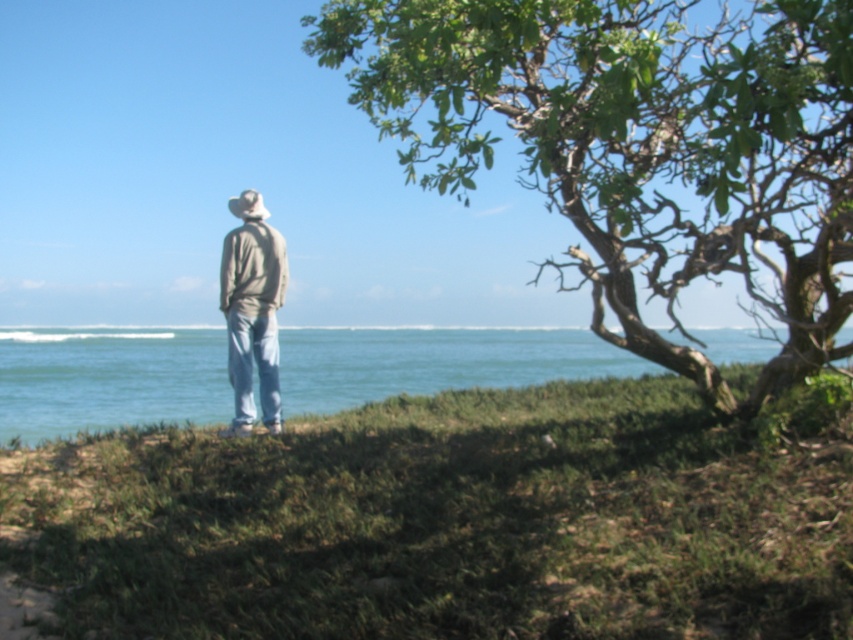
Question: Does green grass at lower center have a larger size compared to light gray cotton jacket at center?

Choices:
 (A) yes
 (B) no

Answer: (A)

Question: Which of the following is the farthest from the observer?

Choices:
 (A) blue water at center
 (B) green leafy tree at upper right

Answer: (B)

Question: Considering the relative positions of blue water at center and light gray cotton jacket at center in the image provided, where is blue water at center located with respect to light gray cotton jacket at center?

Choices:
 (A) below
 (B) above

Answer: (A)

Question: Among these points, which one is nearest to the camera?

Choices:
 (A) (225, 305)
 (B) (540, 410)
 (C) (115, 348)

Answer: (A)

Question: Among these objects, which one is nearest to the camera?

Choices:
 (A) green leafy tree at upper right
 (B) green grass at lower center
 (C) blue water at center
 (D) light gray cotton jacket at center

Answer: (B)

Question: Is green grass at lower center above blue water at center?

Choices:
 (A) yes
 (B) no

Answer: (B)